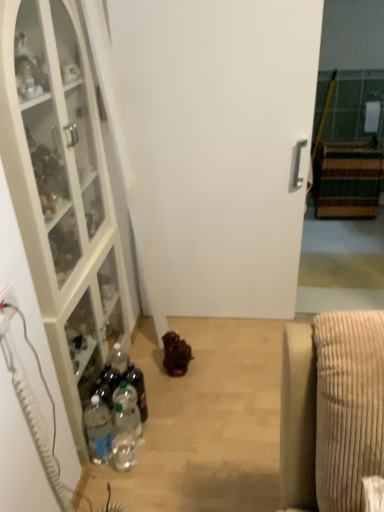
I want to click on vacant space behind clear plastic bottle at center, the 1th bottle when ordered from right to left, so click(x=159, y=388).